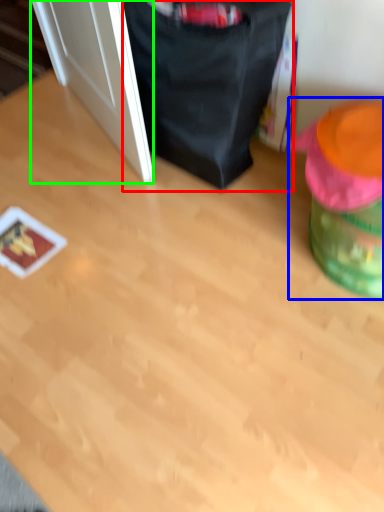
Question: Which is nearer to the bean bag chair (highlighted by a red box)? bean bag chair (highlighted by a blue box) or door (highlighted by a green box).

Choices:
 (A) bean bag chair
 (B) door

Answer: (B)